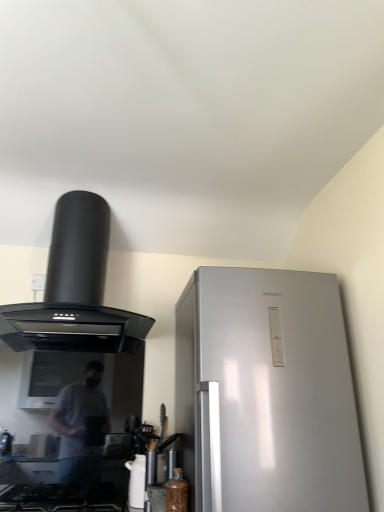
Question: Does white glossy kettle at lower center lie in front of black glass gas stove at lower left?

Choices:
 (A) yes
 (B) no

Answer: (B)

Question: Does white glossy kettle at lower center appear on the right side of black glass gas stove at lower left?

Choices:
 (A) no
 (B) yes

Answer: (B)

Question: Considering the relative sizes of white glossy kettle at lower center and black glass gas stove at lower left in the image provided, is white glossy kettle at lower center smaller than black glass gas stove at lower left?

Choices:
 (A) yes
 (B) no

Answer: (A)

Question: Can you confirm if white glossy kettle at lower center is wider than black glass gas stove at lower left?

Choices:
 (A) yes
 (B) no

Answer: (B)

Question: From a real-world perspective, does white glossy kettle at lower center sit lower than black glass gas stove at lower left?

Choices:
 (A) yes
 (B) no

Answer: (B)

Question: Is white glossy kettle at lower center not within black glass gas stove at lower left?

Choices:
 (A) no
 (B) yes

Answer: (B)

Question: Is black matte range hood at upper left bigger than white glossy kettle at lower center?

Choices:
 (A) yes
 (B) no

Answer: (A)

Question: Considering the relative positions of black matte range hood at upper left and white glossy kettle at lower center in the image provided, is black matte range hood at upper left to the right of white glossy kettle at lower center from the viewer's perspective?

Choices:
 (A) no
 (B) yes

Answer: (A)

Question: Is black matte range hood at upper left facing towards white glossy kettle at lower center?

Choices:
 (A) no
 (B) yes

Answer: (A)

Question: Is black matte range hood at upper left positioned before white glossy kettle at lower center?

Choices:
 (A) no
 (B) yes

Answer: (B)

Question: Are black matte range hood at upper left and white glossy kettle at lower center making contact?

Choices:
 (A) no
 (B) yes

Answer: (A)

Question: Considering the relative sizes of black matte range hood at upper left and white glossy kettle at lower center in the image provided, is black matte range hood at upper left wider than white glossy kettle at lower center?

Choices:
 (A) yes
 (B) no

Answer: (A)

Question: Considering the relative positions of black glass gas stove at lower left and white glossy kettle at lower center in the image provided, is black glass gas stove at lower left to the left of white glossy kettle at lower center from the viewer's perspective?

Choices:
 (A) yes
 (B) no

Answer: (A)